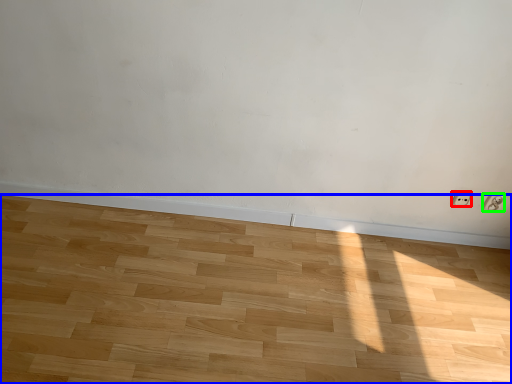
Question: Considering the real-world distances, which object is closest to electric outlet (highlighted by a red box)? hardwood (highlighted by a blue box) or electric outlet (highlighted by a green box).

Choices:
 (A) hardwood
 (B) electric outlet

Answer: (B)